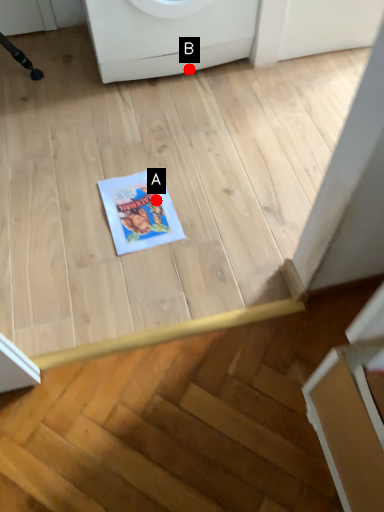
Question: Two points are circled on the image, labeled by A and B beside each circle. Which of the following is the farthest from the observer?

Choices:
 (A) A is further
 (B) B is further

Answer: (B)